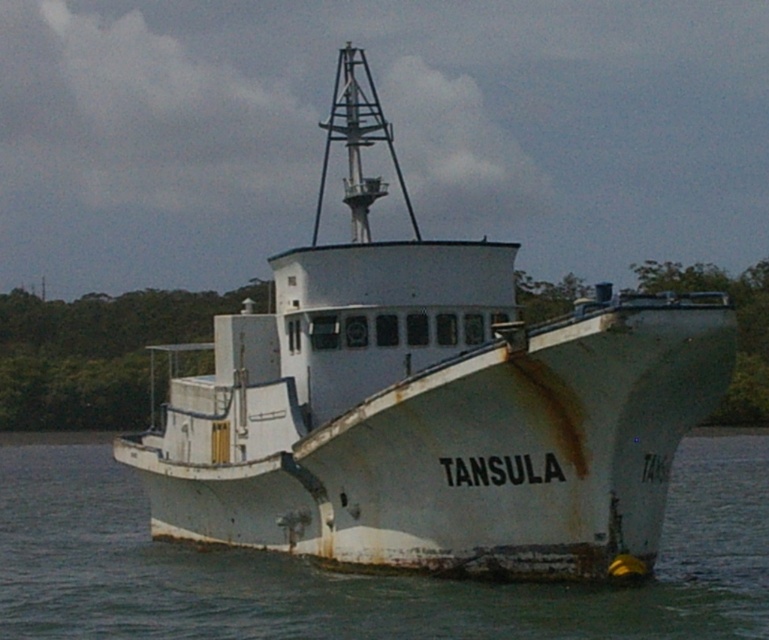
Is white matte boat at center to the right of white matte water at center from the viewer's perspective?

Incorrect, white matte boat at center is not on the right side of white matte water at center.

Does white matte boat at center come behind white matte water at center?

No, white matte boat at center is in front of white matte water at center.

Is point (478, 266) in front of point (48, 531)?

Yes, it is.

Find the location of a particular element. This screenshot has width=769, height=640. white matte boat at center is located at coordinates (430, 404).